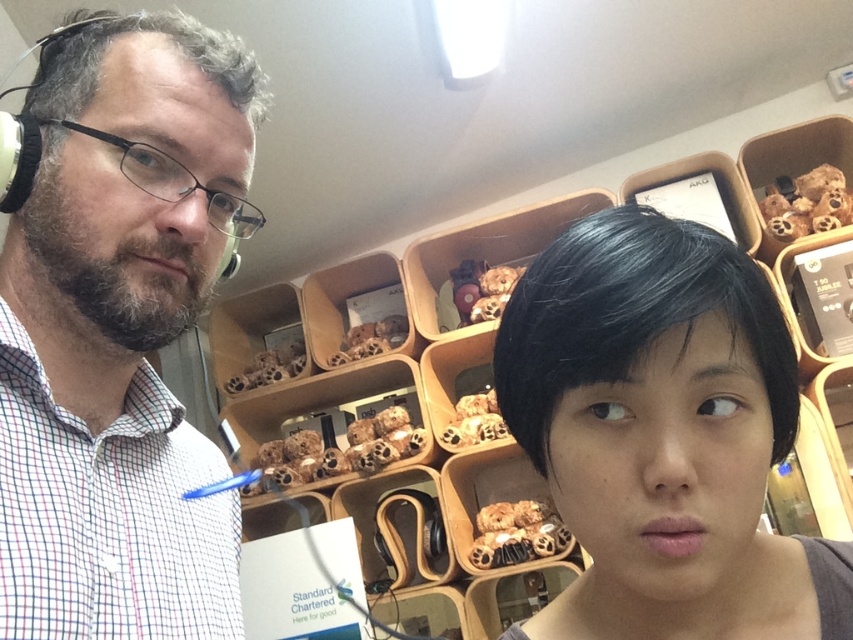
Where is `white matte headphones at left`? The image size is (853, 640). white matte headphones at left is located at coordinates (120, 332).

Which is behind, point (126, 362) or point (229, 259)?

Positioned behind is point (229, 259).

Based on the photo, who is more forward, (106,365) or (233,259)?

Positioned in front is point (106,365).

You are a GUI agent. You are given a task and a screenshot of the screen. Output one action in this format:
    pyautogui.click(x=<x>, y=<y>)
    Task: Click on the white matte headphones at left
    Image resolution: width=853 pixels, height=640 pixels.
    Given the screenshot: What is the action you would take?
    pyautogui.click(x=120, y=332)

Does black matte hair at center have a greater width compared to satin black earphone at upper left?

Yes, black matte hair at center is wider than satin black earphone at upper left.

Does black matte hair at center appear over satin black earphone at upper left?

No.

Which is behind, point (751, 440) or point (236, 259)?

The point (236, 259) is more distant.

Where is `black matte hair at center`? black matte hair at center is located at coordinates (662, 435).

Can you confirm if white matte headphones at left is smaller than black matte hair at center?

Incorrect, white matte headphones at left is not smaller in size than black matte hair at center.

How much distance is there between white matte headphones at left and black matte hair at center?

The distance of white matte headphones at left from black matte hair at center is 12.13 inches.

Is point (181, 468) farther from viewer compared to point (734, 502)?

Yes, it is.

Image resolution: width=853 pixels, height=640 pixels. Find the location of `white matte headphones at left`. white matte headphones at left is located at coordinates click(120, 332).